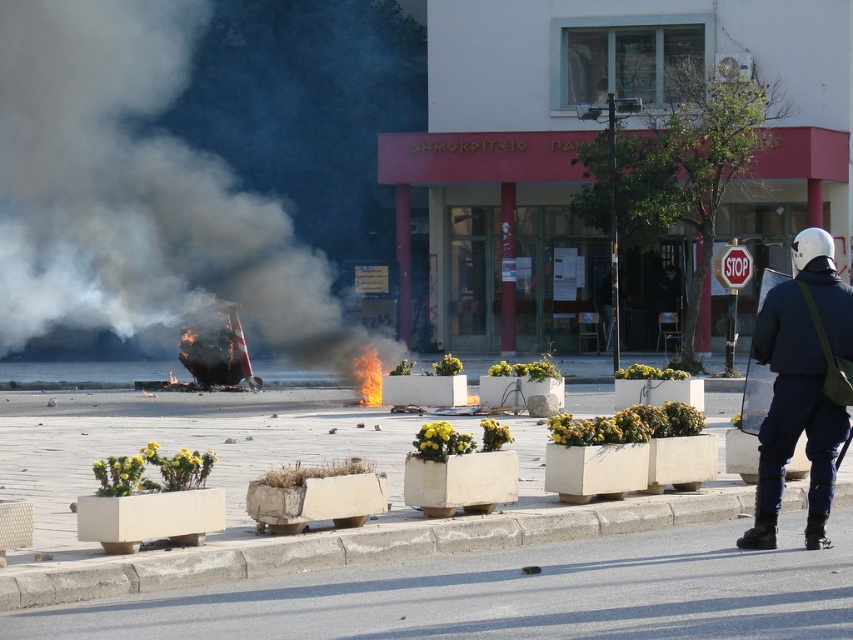
Question: Is black smoke at left to the right of concrete at lower center from the viewer's perspective?

Choices:
 (A) no
 (B) yes

Answer: (A)

Question: Considering the real-world distances, which object is closest to the concrete at lower center?

Choices:
 (A) black smoke at left
 (B) dark blue uniform at right

Answer: (B)

Question: Is black smoke at left smaller than dark blue uniform at right?

Choices:
 (A) yes
 (B) no

Answer: (B)

Question: Which object is positioned farthest from the black smoke at left?

Choices:
 (A) dark blue uniform at right
 (B) concrete at lower center

Answer: (A)

Question: Which of the following is the farthest from the observer?

Choices:
 (A) black smoke at left
 (B) dark blue uniform at right
 (C) concrete at lower center

Answer: (B)

Question: Does concrete at lower center have a greater width compared to dark blue uniform at right?

Choices:
 (A) no
 (B) yes

Answer: (B)